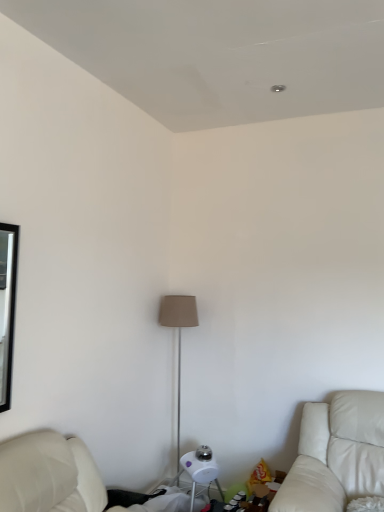
This screenshot has width=384, height=512. I want to click on beige fabric lampshade at center, so pos(178,336).

Describe the element at coordinates (178, 336) in the screenshot. This screenshot has width=384, height=512. I see `beige fabric lampshade at center` at that location.

Where is `beige fabric lampshade at center`? This screenshot has height=512, width=384. beige fabric lampshade at center is located at coordinates (178, 336).